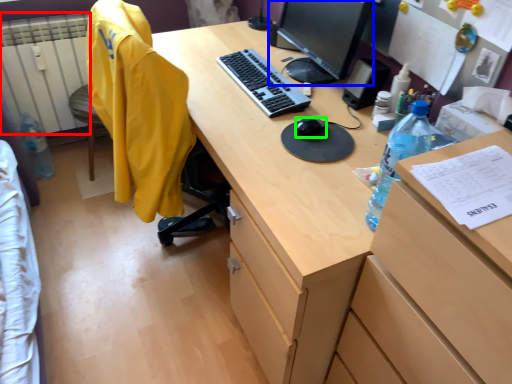
Question: Which object is the farthest from radiator (highlighted by a red box)? Choose among these: television (highlighted by a blue box) or mouse (highlighted by a green box).

Choices:
 (A) television
 (B) mouse

Answer: (B)